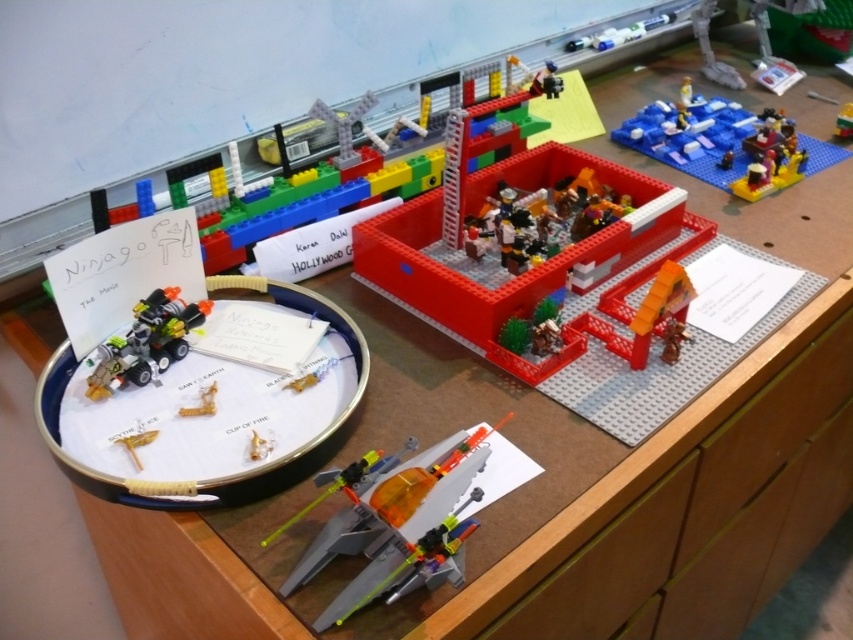
Question: Can you confirm if translucent orange plastic spaceship at center is thinner than shiny metallic motorcycle at left?

Choices:
 (A) yes
 (B) no

Answer: (B)

Question: Is translucent orange plastic spaceship at center thinner than metallic gold cup at center?

Choices:
 (A) no
 (B) yes

Answer: (A)

Question: Which object is closer to the camera taking this photo?

Choices:
 (A) bright red plastic building at center
 (B) translucent orange plastic sword at lower left
 (C) metallic gold cup at center

Answer: (B)

Question: Which point is farther to the camera?

Choices:
 (A) shiny metallic motorcycle at left
 (B) translucent orange plastic sword at lower left
 (C) bright red plastic building at center

Answer: (C)

Question: Which point is closer to the camera?

Choices:
 (A) (637, 186)
 (B) (209, 390)
 (C) (264, 440)
 (D) (126, 444)

Answer: (D)

Question: Is shiny metallic motorcycle at left to the left of translucent orange plastic cup at lower left from the viewer's perspective?

Choices:
 (A) yes
 (B) no

Answer: (A)